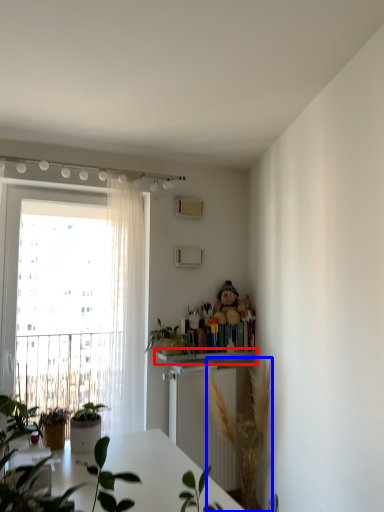
Question: Which of the following is the closest to the observer, shelf (highlighted by a red box) or houseplant (highlighted by a blue box)?

Choices:
 (A) shelf
 (B) houseplant

Answer: (B)